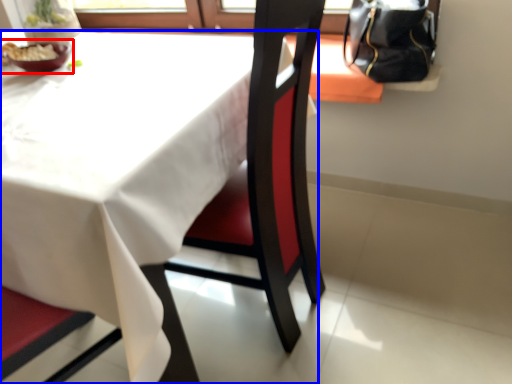
Question: Which object is closer to the camera taking this photo, tableware (highlighted by a red box) or table (highlighted by a blue box)?

Choices:
 (A) tableware
 (B) table

Answer: (B)